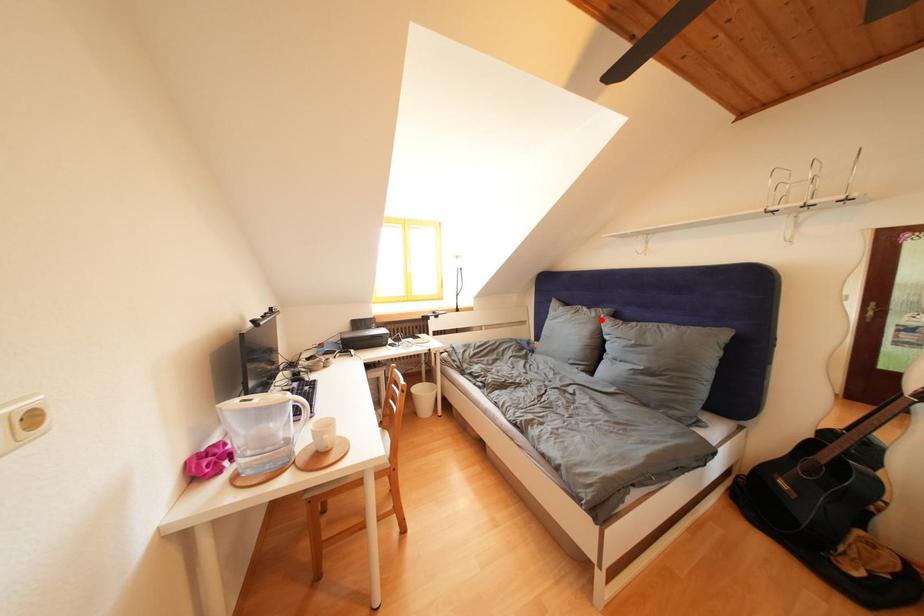
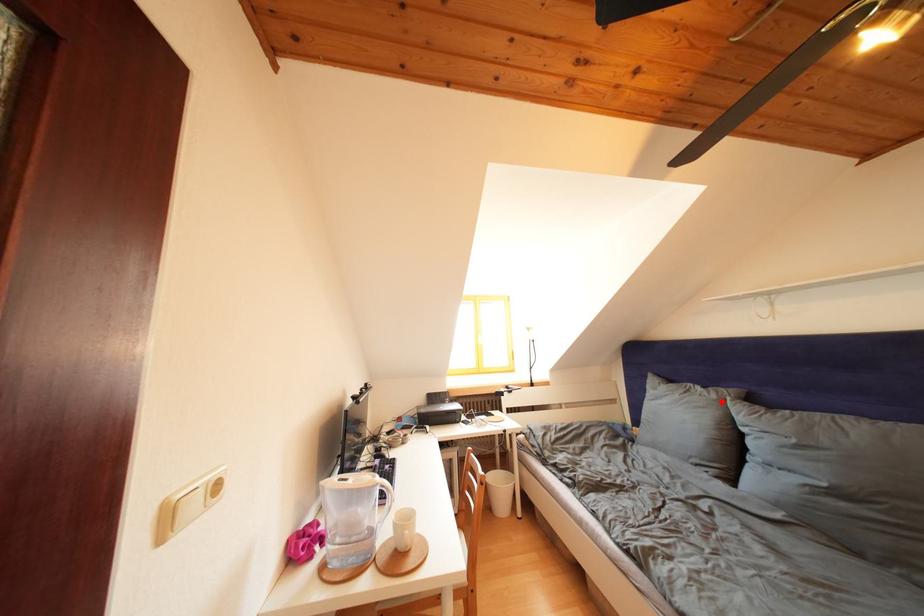
Based on the photo, I am providing you with two images of the same scene from different viewpoints. A red point is marked on the first image and another point is marked on the second image. Are the points marked in image1 and image2 representing the same 3D position?

Yes